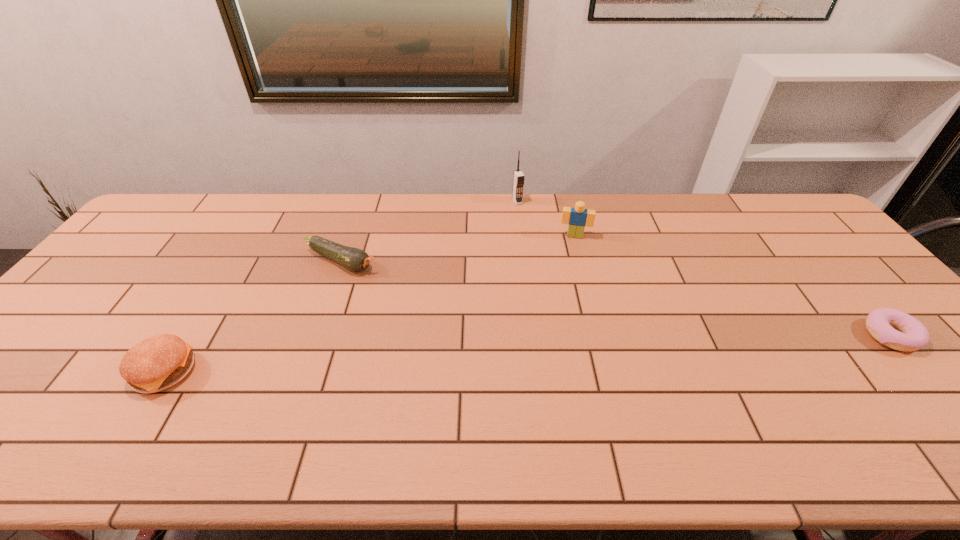
Locate an element on the screen. The height and width of the screenshot is (540, 960). the leftmost object is located at coordinates (159, 362).

This screenshot has width=960, height=540. What are the coordinates of `the third tallest object` in the screenshot? It's located at (159, 362).

In order to click on doughnut in this screenshot , I will do `click(912, 335)`.

Locate an element on the screen. the shortest object is located at coordinates (912, 335).

Where is `the tallest object`? This screenshot has width=960, height=540. the tallest object is located at coordinates (518, 177).

Where is `the farthest object`? the farthest object is located at coordinates (518, 177).

This screenshot has width=960, height=540. I want to click on the second shortest object, so click(x=354, y=259).

Locate an element on the screen. The height and width of the screenshot is (540, 960). the fourth object from right to left is located at coordinates (354, 259).

Find the location of a particular element. The width and height of the screenshot is (960, 540). the second tallest object is located at coordinates (579, 217).

At what (x,y) coordinates should I click in order to perform the action: click on the fourth nearest object. Please return your answer as a coordinate pair (x, y). Looking at the image, I should click on (579, 217).